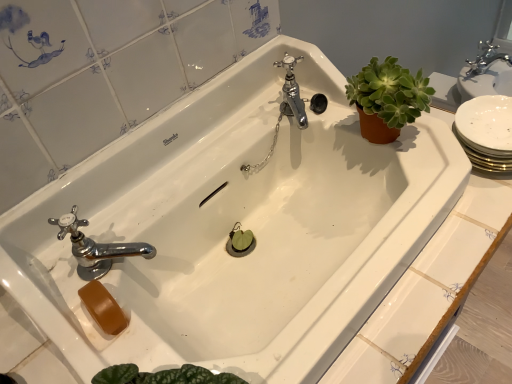
Question: Is chrome metallic faucet at center, the first tap viewed from the back, placed right next to chrome metallic faucet at lower left, marked as the second tap in a back-to-front arrangement?

Choices:
 (A) no
 (B) yes

Answer: (A)

Question: From the image's perspective, would you say chrome metallic faucet at center, the second tap viewed from the front, is shown under chrome metallic faucet at lower left, placed as the 1th tap when sorted from front to back?

Choices:
 (A) yes
 (B) no

Answer: (B)

Question: Is chrome metallic faucet at center, the first tap viewed from the back, smaller than chrome metallic faucet at lower left, arranged as the second tap when viewed from the top?

Choices:
 (A) yes
 (B) no

Answer: (A)

Question: Would you say chrome metallic faucet at center, the second tap viewed from the left, is a long distance from chrome metallic faucet at lower left, which is the second tap from right to left?

Choices:
 (A) yes
 (B) no

Answer: (B)

Question: Is chrome metallic faucet at center, the 1th tap positioned from the top, positioned before chrome metallic faucet at lower left, marked as the second tap in a back-to-front arrangement?

Choices:
 (A) no
 (B) yes

Answer: (A)

Question: Is point (398, 77) closer or farther from the camera than point (109, 254)?

Choices:
 (A) farther
 (B) closer

Answer: (A)

Question: Is green succulent at upper right in front of or behind chrome metallic faucet at lower left, arranged as the second tap when viewed from the top, in the image?

Choices:
 (A) front
 (B) behind

Answer: (B)

Question: From a real-world perspective, relative to chrome metallic faucet at lower left, the 1th tap in the bottom-to-top sequence, is green succulent at upper right vertically above or below?

Choices:
 (A) below
 (B) above

Answer: (B)

Question: Looking at the image, does green succulent at upper right seem bigger or smaller compared to chrome metallic faucet at lower left, arranged as the second tap when viewed from the top?

Choices:
 (A) big
 (B) small

Answer: (A)

Question: Considering the positions of chrome metallic faucet at lower left, arranged as the second tap when viewed from the top, and green succulent at upper right in the image, is chrome metallic faucet at lower left, arranged as the second tap when viewed from the top, wider or thinner than green succulent at upper right?

Choices:
 (A) wide
 (B) thin

Answer: (B)

Question: In terms of size, does chrome metallic faucet at lower left, the 1th tap in the bottom-to-top sequence, appear bigger or smaller than green succulent at upper right?

Choices:
 (A) big
 (B) small

Answer: (B)

Question: Choose the correct answer: Is chrome metallic faucet at lower left, which is the first tap in left-to-right order, inside green succulent at upper right or outside it?

Choices:
 (A) inside
 (B) outside

Answer: (B)

Question: In the image, is chrome metallic faucet at lower left, which is the second tap from right to left, positioned in front of or behind green succulent at upper right?

Choices:
 (A) behind
 (B) front

Answer: (B)

Question: Is chrome metallic faucet at center, the 2th tap positioned from the bottom, situated inside chrome metallic faucet at lower left, the 1th tap in the bottom-to-top sequence, or outside?

Choices:
 (A) inside
 (B) outside

Answer: (B)

Question: In terms of width, does chrome metallic faucet at center, the first tap viewed from the back, look wider or thinner when compared to chrome metallic faucet at lower left, which is the first tap in left-to-right order?

Choices:
 (A) wide
 (B) thin

Answer: (B)